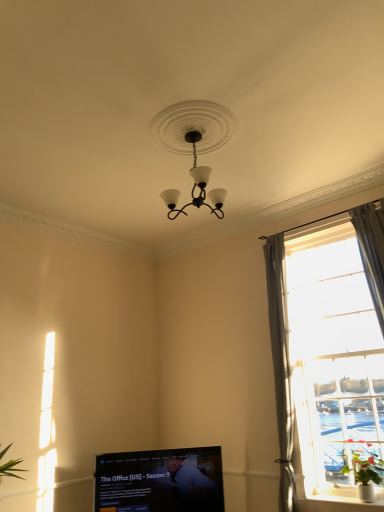
Question: Considering their positions, is green leafy plant at right located in front of or behind matte black television at lower center?

Choices:
 (A) front
 (B) behind

Answer: (A)

Question: From the image's perspective, is green leafy plant at right positioned above or below matte black television at lower center?

Choices:
 (A) below
 (B) above

Answer: (B)

Question: Which object is positioned farthest from the matte black chandelier at center?

Choices:
 (A) green leafy plant at right
 (B) clear glass window at right
 (C) matte black television at lower center
 (D) white glossy window sill at lower right

Answer: (D)

Question: Considering the real-world distances, which object is farthest from the matte black chandelier at center?

Choices:
 (A) clear glass window at right
 (B) white glossy window sill at lower right
 (C) green leafy plant at right
 (D) matte black television at lower center

Answer: (B)